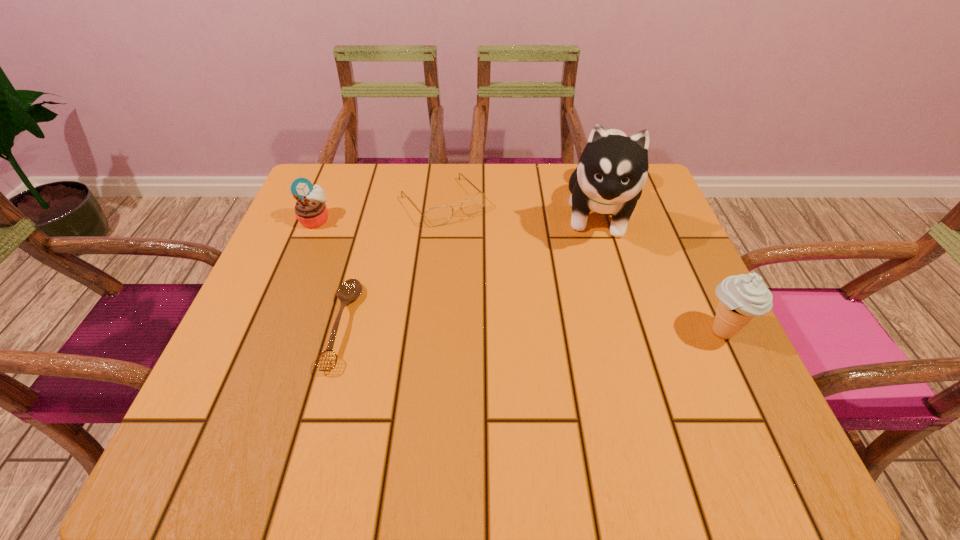
Where is `free spot on the desktop that is between the shortest object and the second tallest object and is positioned at the face of the fourth object from left to right`? free spot on the desktop that is between the shortest object and the second tallest object and is positioned at the face of the fourth object from left to right is located at coordinates tap(585, 329).

Find the location of a particular element. free spot on the desktop that is between the shortest object and the rightmost object and is positioned on the front-facing side of the third tallest object is located at coordinates (511, 328).

Where is `vacant space on the desktop that is between the shortest object and the fourth shortest object and is positioned on the front-facing side of the spectacles`? vacant space on the desktop that is between the shortest object and the fourth shortest object and is positioned on the front-facing side of the spectacles is located at coordinates (551, 329).